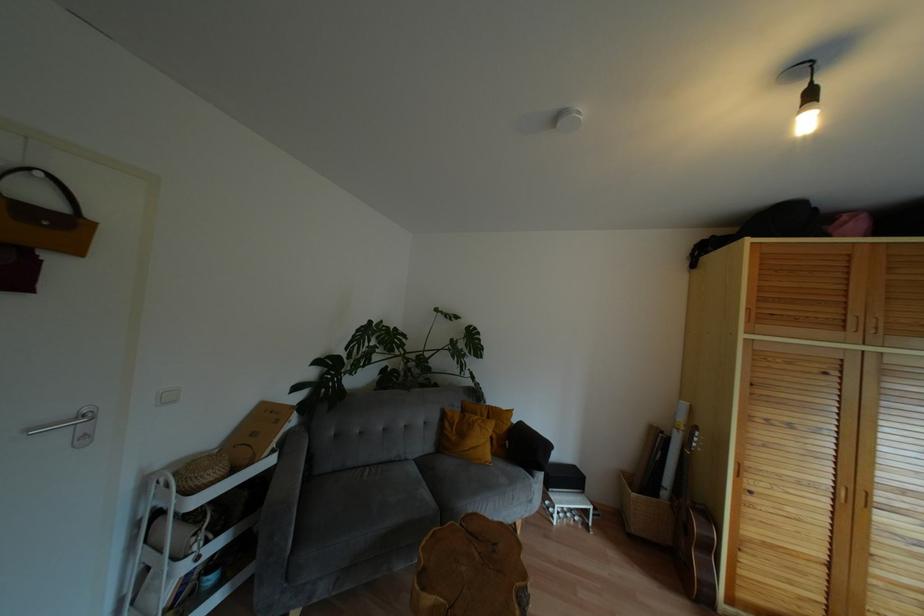
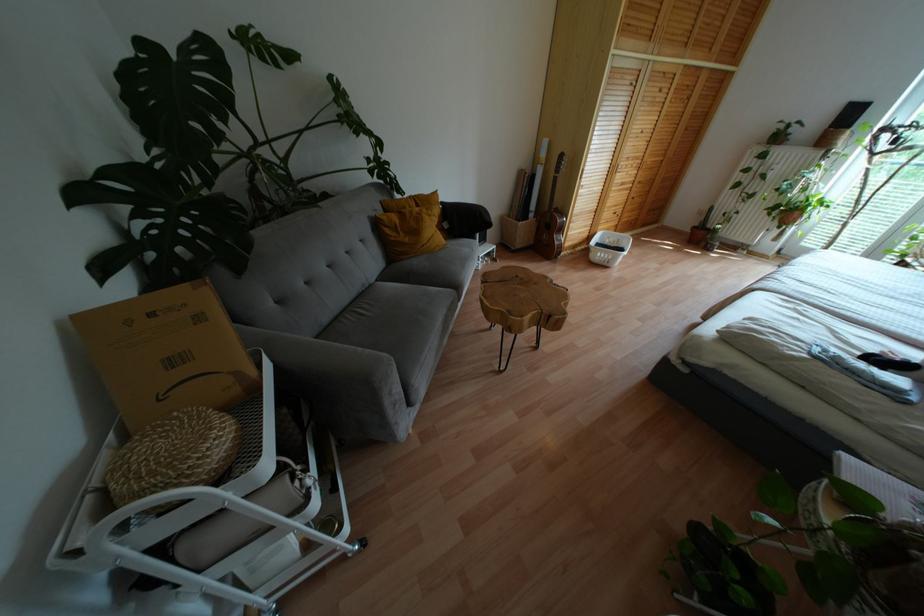
Locate, in the second image, the point that corresponds to pixel 710 548 in the first image.

(560, 229)